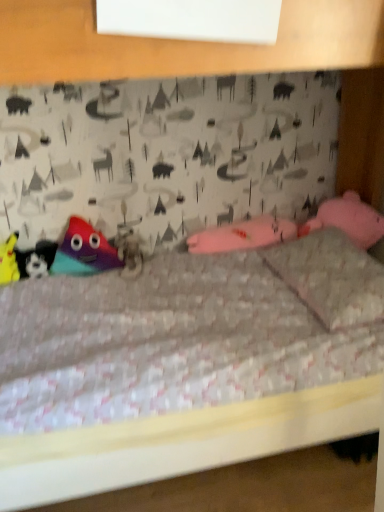
Question: Is matte black plush at left, which is the 2th toy in left-to-right order, thinner than pink fabric pillow at upper right?

Choices:
 (A) yes
 (B) no

Answer: (A)

Question: Is matte black plush at left, which is the 2th toy in left-to-right order, to the right of pink fabric pillow at upper right from the viewer's perspective?

Choices:
 (A) no
 (B) yes

Answer: (A)

Question: Does matte black plush at left, which is counted as the second toy, starting from the right, have a larger size compared to pink fabric pillow at upper right?

Choices:
 (A) no
 (B) yes

Answer: (A)

Question: Is matte black plush at left, which is the 2th toy in left-to-right order, in front of pink fabric pillow at upper right?

Choices:
 (A) no
 (B) yes

Answer: (A)

Question: Considering the relative sizes of matte black plush at left, which is counted as the second toy, starting from the right, and pink fabric pillow at upper right in the image provided, is matte black plush at left, which is counted as the second toy, starting from the right, wider than pink fabric pillow at upper right?

Choices:
 (A) yes
 (B) no

Answer: (B)

Question: From the image's perspective, relative to matte black plush at left, which is the 2th toy in left-to-right order, is yellow fabric toy at lower left, the 1th toy positioned from the left, above or below?

Choices:
 (A) above
 (B) below

Answer: (A)

Question: Considering the positions of point (0, 262) and point (26, 258), is point (0, 262) closer or farther from the camera than point (26, 258)?

Choices:
 (A) farther
 (B) closer

Answer: (B)

Question: In the image, is yellow fabric toy at lower left, marked as the 3th toy in a right-to-left arrangement, on the left side or the right side of matte black plush at left, which is counted as the second toy, starting from the right?

Choices:
 (A) left
 (B) right

Answer: (A)

Question: Considering their positions, is yellow fabric toy at lower left, marked as the 3th toy in a right-to-left arrangement, located in front of or behind matte black plush at left, which is the 2th toy in left-to-right order?

Choices:
 (A) front
 (B) behind

Answer: (A)

Question: Is fuzzy fabric animal at center to the left or to the right of matte black plush at left, which is counted as the second toy, starting from the right, in the image?

Choices:
 (A) right
 (B) left

Answer: (A)

Question: From the image's perspective, is fuzzy fabric animal at center positioned above or below matte black plush at left, which is the 2th toy in left-to-right order?

Choices:
 (A) above
 (B) below

Answer: (A)

Question: Looking at their shapes, would you say fuzzy fabric animal at center is wider or thinner than matte black plush at left, which is counted as the second toy, starting from the right?

Choices:
 (A) wide
 (B) thin

Answer: (A)

Question: From a real-world perspective, is fuzzy fabric animal at center positioned above or below matte black plush at left, which is counted as the second toy, starting from the right?

Choices:
 (A) below
 (B) above

Answer: (A)

Question: Visually, is matte black plush at left, which is the 2th toy in left-to-right order, positioned to the left or to the right of fuzzy fabric animal at center?

Choices:
 (A) right
 (B) left

Answer: (B)

Question: From a real-world perspective, relative to fuzzy fabric animal at center, is matte black plush at left, which is the 2th toy in left-to-right order, vertically above or below?

Choices:
 (A) below
 (B) above

Answer: (B)